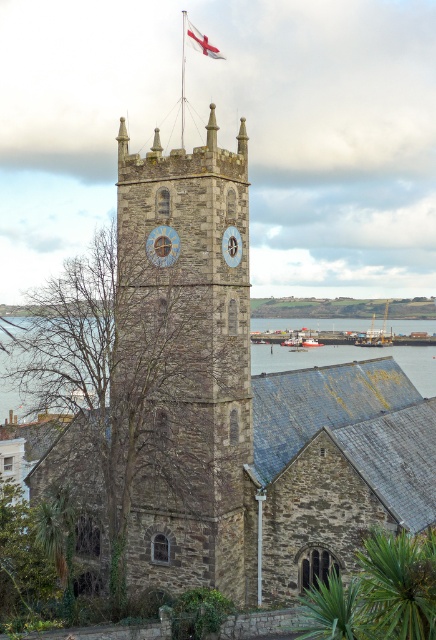
Question: Estimate the real-world distances between objects in this image. Which object is farther from the blue stone clock at center?

Choices:
 (A) red fabric flag at upper center
 (B) stone clock tower at center
 (C) blue painted wood clock at center
 (D) blue water at lower right

Answer: (A)

Question: Can you confirm if stone clock tower at center is positioned to the right of blue stone clock at center?

Choices:
 (A) no
 (B) yes

Answer: (A)

Question: Does stone clock tower at center appear over blue stone clock at center?

Choices:
 (A) yes
 (B) no

Answer: (B)

Question: Among these objects, which one is farthest from the camera?

Choices:
 (A) stone clock tower at center
 (B) blue water at lower right

Answer: (B)

Question: Which point is closer to the camera taking this photo?

Choices:
 (A) (184, 19)
 (B) (166, 266)
 (C) (238, 243)
 (D) (174, 312)

Answer: (D)

Question: Is stone clock tower at center bigger than blue stone clock at center?

Choices:
 (A) no
 (B) yes

Answer: (B)